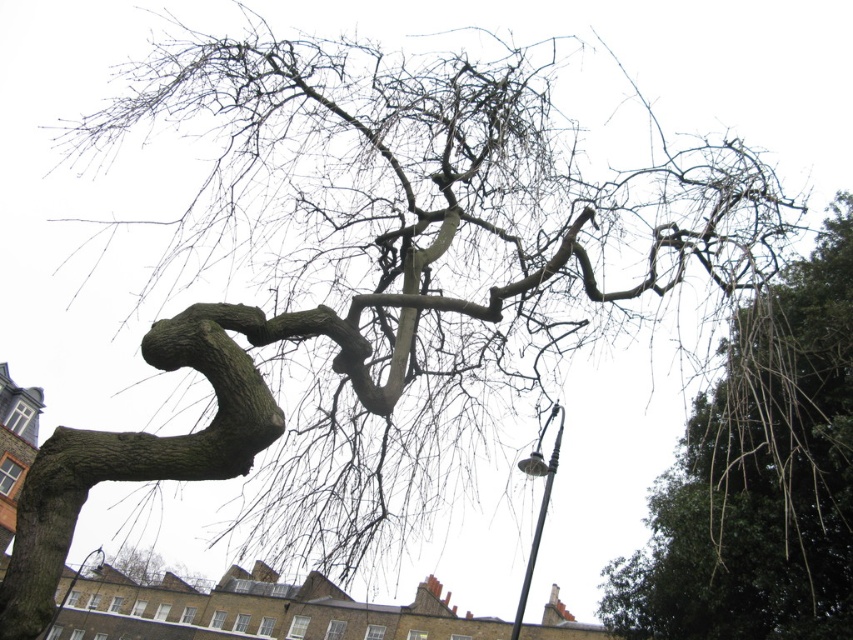
You are a bird looking for a place to land. You see the bare branches at upper right and the streetlamp near the tree. Which one is farther from you?

The bare branches at upper right are farther from you than the streetlamp near the tree, as they are 56.91 feet apart.

You are standing at the point marked by the coordinates point [540,502]. Looking towards the tree with a gnarled trunk, which object is directly in front of you?

The black metal streetlight at lower right is directly in front of you at point [540,502].